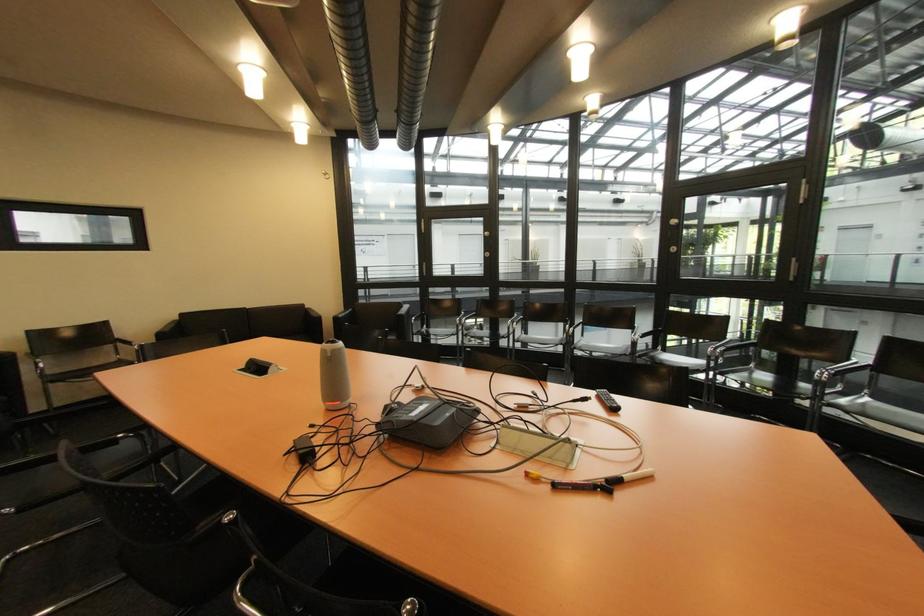
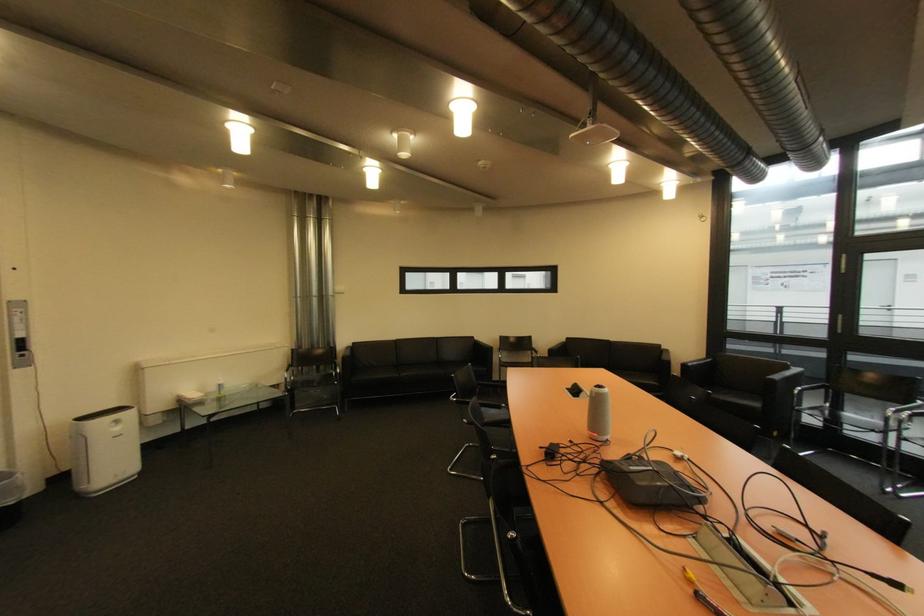
Where in the second image is the point corresponding to the point at 277,371 from the first image?

(590, 397)